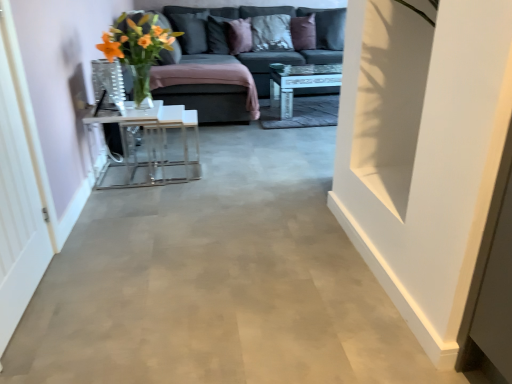
Question: Is textured gray pillow at upper center, the second pillow from the right, further to camera compared to purple velvet pillow at upper center, the 3th pillow when ordered from right to left?

Choices:
 (A) no
 (B) yes

Answer: (B)

Question: Is textured gray pillow at upper center, the second pillow from the right, smaller than purple velvet pillow at upper center, the third pillow positioned from the left?

Choices:
 (A) no
 (B) yes

Answer: (A)

Question: Would you say textured gray pillow at upper center, the second pillow from the right, contains purple velvet pillow at upper center, the third pillow positioned from the left?

Choices:
 (A) no
 (B) yes

Answer: (A)

Question: Is textured gray pillow at upper center, the second pillow from the right, placed right next to purple velvet pillow at upper center, the 3th pillow when ordered from right to left?

Choices:
 (A) no
 (B) yes

Answer: (A)

Question: From the image's perspective, is textured gray pillow at upper center, which is counted as the 4th pillow, starting from the left, above purple velvet pillow at upper center, the third pillow positioned from the left?

Choices:
 (A) yes
 (B) no

Answer: (A)

Question: Based on their positions, is dark gray fabric pillow at upper center, the 4th pillow in the right-to-left sequence, located to the left or right of textured gray pillow at upper center, which is counted as the 4th pillow, starting from the left?

Choices:
 (A) left
 (B) right

Answer: (A)

Question: Does point (211, 16) appear closer or farther from the camera than point (270, 31)?

Choices:
 (A) farther
 (B) closer

Answer: (B)

Question: From a real-world perspective, is dark gray fabric pillow at upper center, the 4th pillow in the right-to-left sequence, physically located above or below textured gray pillow at upper center, the second pillow from the right?

Choices:
 (A) above
 (B) below

Answer: (A)

Question: Is dark gray fabric pillow at upper center, positioned as the 2th pillow in left-to-right order, bigger or smaller than textured gray pillow at upper center, the second pillow from the right?

Choices:
 (A) big
 (B) small

Answer: (B)

Question: Is purple velvet pillow at upper center, marked as the first pillow in a right-to-left arrangement, to the left or to the right of white matte door at right in the image?

Choices:
 (A) left
 (B) right

Answer: (A)

Question: Is purple velvet pillow at upper center, which is the fifth pillow in left-to-right order, wider or thinner than white matte door at right?

Choices:
 (A) wide
 (B) thin

Answer: (A)

Question: From the image's perspective, is purple velvet pillow at upper center, which is the fifth pillow in left-to-right order, positioned above or below white matte door at right?

Choices:
 (A) below
 (B) above

Answer: (B)

Question: Is point (296, 43) positioned closer to the camera than point (388, 29)?

Choices:
 (A) closer
 (B) farther

Answer: (B)

Question: In the image, is transparent glass door at left positioned in front of or behind textured gray pillow at upper center, the second pillow from the right?

Choices:
 (A) front
 (B) behind

Answer: (A)

Question: From a real-world perspective, is transparent glass door at left above or below textured gray pillow at upper center, which is counted as the 4th pillow, starting from the left?

Choices:
 (A) above
 (B) below

Answer: (B)